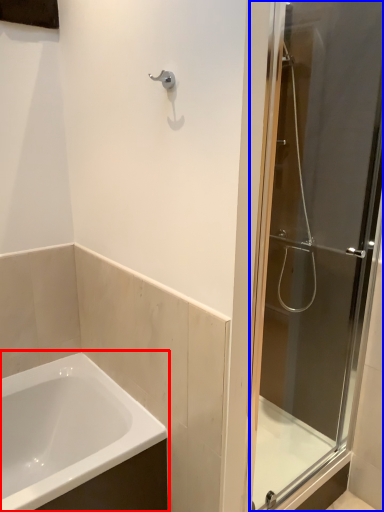
Question: Which of the following is the closest to the observer, bathtub (highlighted by a red box) or door (highlighted by a blue box)?

Choices:
 (A) bathtub
 (B) door

Answer: (B)